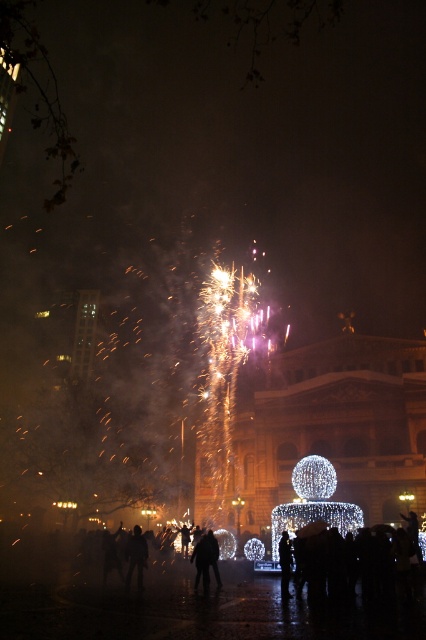
Question: Can you confirm if black matte person at center is smaller than dark clothing figure at center?

Choices:
 (A) yes
 (B) no

Answer: (B)

Question: Among these objects, which one is farthest from the camera?

Choices:
 (A) dark clothing figure at center
 (B) black matte person at center

Answer: (A)

Question: Can you confirm if black matte person at center is smaller than dark clothing figure at center?

Choices:
 (A) no
 (B) yes

Answer: (A)

Question: Can you confirm if black matte person at center is positioned to the right of dark clothing figure at center?

Choices:
 (A) no
 (B) yes

Answer: (B)